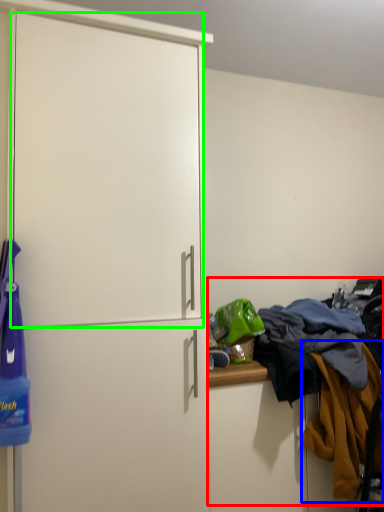
Question: Which object is positioned farthest from laundry (highlighted by a red box)? Select from clothing (highlighted by a blue box) and screen door (highlighted by a green box).

Choices:
 (A) clothing
 (B) screen door

Answer: (B)